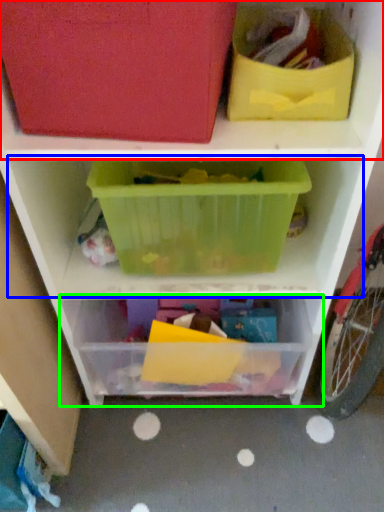
Question: Which object is positioned closest to shelf (highlighted by a red box)? Select from shelf (highlighted by a blue box) and shelf (highlighted by a green box).

Choices:
 (A) shelf
 (B) shelf

Answer: (A)